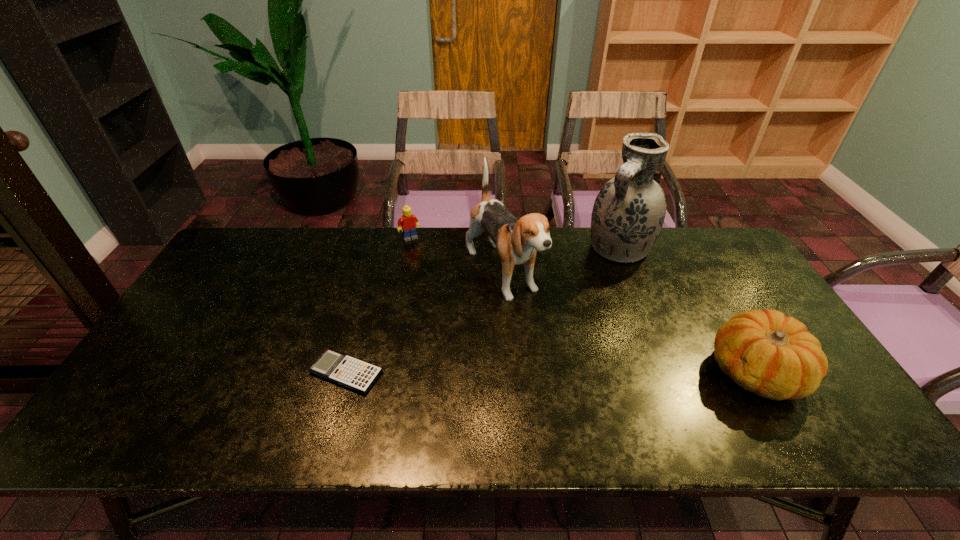
You are a GUI agent. You are given a task and a screenshot of the screen. Output one action in this format:
    pyautogui.click(x=<x>, y=<y>)
    Task: Click on the calculator
    This screenshot has height=540, width=960.
    Given the screenshot: What is the action you would take?
    pyautogui.click(x=347, y=371)

Find the location of a particular element. gourd is located at coordinates (765, 352).

Identify the location of the fourth shortest object. (517, 240).

Find the location of a particular element. the third object from left to right is located at coordinates (517, 240).

Find the location of a particular element. This screenshot has height=540, width=960. Lego is located at coordinates pos(408,223).

You are a GUI agent. You are given a task and a screenshot of the screen. Output one action in this format:
    pyautogui.click(x=<x>, y=<y>)
    Task: Click on the vase
    Image resolution: width=960 pixels, height=540 pixels.
    Given the screenshot: What is the action you would take?
    pyautogui.click(x=629, y=211)

Find the location of a particular element. Image resolution: width=960 pixels, height=540 pixels. free region located on the right of the shortest object is located at coordinates (471, 373).

The height and width of the screenshot is (540, 960). Identify the location of blank space located on the left of the gourd. (688, 372).

The image size is (960, 540). Find the location of `free location located at the face of the puppy`. free location located at the face of the puppy is located at coordinates (542, 336).

The image size is (960, 540). I want to click on free space located at the face of the puppy, so click(598, 406).